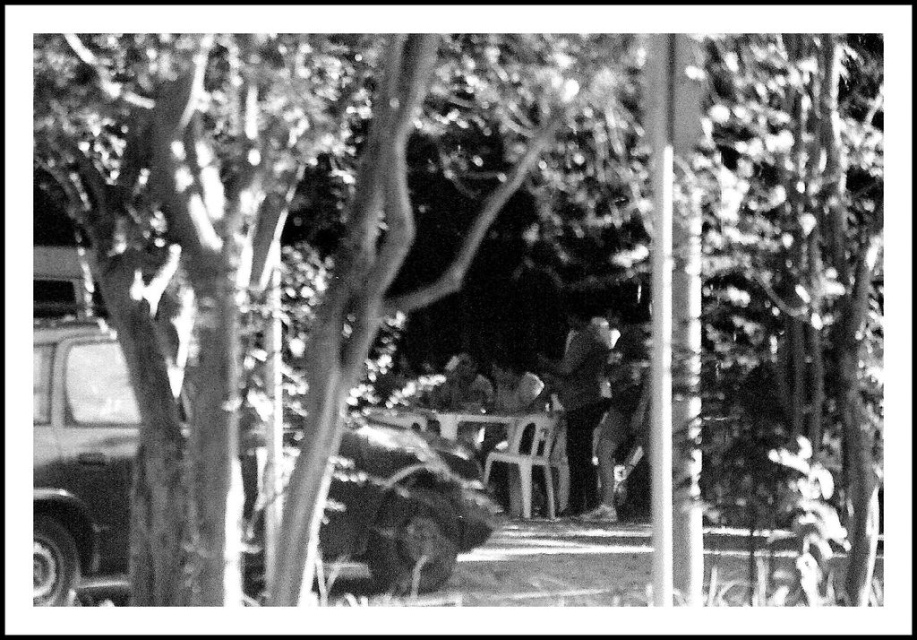
Question: Does dark matte car at left have a larger size compared to dark textured jacket at center?

Choices:
 (A) no
 (B) yes

Answer: (B)

Question: Among these objects, which one is farthest from the camera?

Choices:
 (A) dark matte car at left
 (B) dark textured jacket at center
 (C) white plastic chair at center

Answer: (C)

Question: Estimate the real-world distances between objects in this image. Which object is closer to the white plastic chair at center?

Choices:
 (A) dark textured jacket at center
 (B) dark matte car at left

Answer: (A)

Question: Which point is closer to the camera?

Choices:
 (A) (525, 444)
 (B) (69, 557)

Answer: (B)

Question: Is dark textured jacket at center above white plastic chair at center?

Choices:
 (A) no
 (B) yes

Answer: (B)

Question: In this image, where is dark textured jacket at center located relative to white plastic chair at center?

Choices:
 (A) above
 (B) below

Answer: (A)